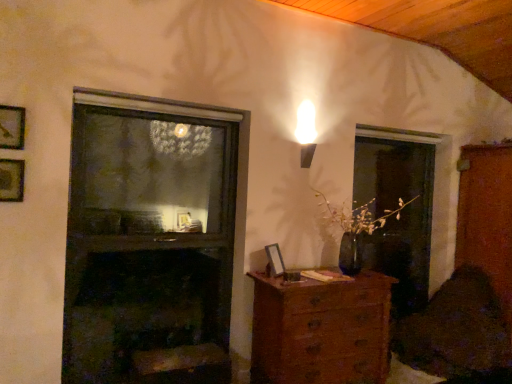
Measure the distance between wooden picture frame at lower center, which is the first picture frame in right-to-left order, and camera.

wooden picture frame at lower center, which is the first picture frame in right-to-left order, and camera are 2.97 meters apart from each other.

This screenshot has width=512, height=384. Describe the element at coordinates (486, 215) in the screenshot. I see `wooden file cabinet at right` at that location.

This screenshot has height=384, width=512. Find the location of `transparent glass screen door at right`. transparent glass screen door at right is located at coordinates (401, 213).

From the image's perspective, is wooden picture frame at upper left, acting as the second picture frame starting from the right, above or below transparent glass screen door at right?

Based on their image positions, wooden picture frame at upper left, acting as the second picture frame starting from the right, is located above transparent glass screen door at right.

In the scene shown: Is wooden picture frame at upper left, which is the third picture frame in back-to-front order, aimed at transparent glass screen door at right?

No, wooden picture frame at upper left, which is the third picture frame in back-to-front order, is not turned towards transparent glass screen door at right.

Is wooden picture frame at upper left, the second picture frame in the left-to-right sequence, inside the boundaries of transparent glass screen door at right, or outside?

The correct answer is: outside.

Between wooden picture frame at upper left, acting as the second picture frame starting from the right, and transparent glass screen door at right, which one has smaller width?

With smaller width is wooden picture frame at upper left, acting as the second picture frame starting from the right.

Is wooden picture frame at lower center, which is counted as the third picture frame, starting from the top, aimed at transparent glass screen door at right?

No, wooden picture frame at lower center, which is counted as the third picture frame, starting from the top, is not facing towards transparent glass screen door at right.

Does wooden picture frame at lower center, marked as the 1th picture frame in a bottom-to-top arrangement, have a smaller size compared to transparent glass screen door at right?

Yes.

From the image's perspective, does wooden picture frame at lower center, which is the first picture frame in right-to-left order, appear lower than transparent glass screen door at right?

Correct, wooden picture frame at lower center, which is the first picture frame in right-to-left order, appears lower than transparent glass screen door at right in the image.

Is wooden picture frame at upper left, acting as the second picture frame starting from the right, to the left of wooden file cabinet at right from the viewer's perspective?

Yes.

Is wooden picture frame at upper left, which is the 1th picture frame from top to bottom, shorter than wooden file cabinet at right?

Yes, wooden picture frame at upper left, which is the 1th picture frame from top to bottom, is shorter than wooden file cabinet at right.

From a real-world perspective, is wooden picture frame at upper left, which is the 1th picture frame from top to bottom, beneath wooden file cabinet at right?

No, from a real-world perspective, wooden picture frame at upper left, which is the 1th picture frame from top to bottom, is not under wooden file cabinet at right.

Is point (1, 186) positioned before point (2, 108)?

No.

At what (x,y) coordinates should I click in order to perform the action: click on picture frame above the wooden picture frame at upper left, the second picture frame from the front (from the image's perspective). Please return your answer as a coordinate pair (x, y). The width and height of the screenshot is (512, 384). Looking at the image, I should click on tap(12, 127).

From a real-world perspective, between wooden picture frame at upper left, the second picture frame from the front, and wooden picture frame at upper left, which is the 1th picture frame from top to bottom, who is vertically lower?

In real-world perspective, wooden picture frame at upper left, the second picture frame from the front, is lower.

In the scene shown: In the image, is wooden picture frame at upper left, marked as the 2th picture frame in a bottom-to-top arrangement, on the left side or the right side of wooden picture frame at upper left, positioned as the 3th picture frame in bottom-to-top order?

wooden picture frame at upper left, marked as the 2th picture frame in a bottom-to-top arrangement, is to the left of wooden picture frame at upper left, positioned as the 3th picture frame in bottom-to-top order.

Consider the image. Is transparent glass screen door at right bigger than velvet dark brown swivel chair at lower right?

Actually, transparent glass screen door at right might be smaller than velvet dark brown swivel chair at lower right.

Would you say velvet dark brown swivel chair at lower right is part of transparent glass screen door at right's contents?

That's incorrect, velvet dark brown swivel chair at lower right is not inside transparent glass screen door at right.

Does point (406, 162) lie behind point (483, 367)?

Yes, it is.

Measure the distance from wooden file cabinet at right to velvet dark brown swivel chair at lower right.

They are 20.22 inches apart.

Which of these two, wooden file cabinet at right or velvet dark brown swivel chair at lower right, is bigger?

wooden file cabinet at right is bigger.

The height and width of the screenshot is (384, 512). I want to click on file cabinet behind the velvet dark brown swivel chair at lower right, so click(486, 215).

In terms of height, does wooden file cabinet at right look taller or shorter compared to velvet dark brown swivel chair at lower right?

Considering their sizes, wooden file cabinet at right has more height than velvet dark brown swivel chair at lower right.

Based on the photo, from the image's perspective, who appears lower, wooden picture frame at upper left, marked as the 2th picture frame in a bottom-to-top arrangement, or velvet dark brown swivel chair at lower right?

velvet dark brown swivel chair at lower right, from the image's perspective.

Is wooden picture frame at upper left, which is the 2th picture frame in back-to-front order, in front of velvet dark brown swivel chair at lower right?

Yes, wooden picture frame at upper left, which is the 2th picture frame in back-to-front order, is closer to the viewer.

Between point (23, 187) and point (457, 311), which one is positioned behind?

The point (457, 311) is behind.

Is wooden picture frame at upper left, the second picture frame from the front, wider or thinner than velvet dark brown swivel chair at lower right?

Considering their sizes, wooden picture frame at upper left, the second picture frame from the front, looks slimmer than velvet dark brown swivel chair at lower right.

At what (x,y) coordinates should I click in order to perform the action: click on screen door on the right of wooden picture frame at upper left, positioned as the 3th picture frame in bottom-to-top order. Please return your answer as a coordinate pair (x, y). The image size is (512, 384). Looking at the image, I should click on (401, 213).

Find the location of a particular element. The width and height of the screenshot is (512, 384). picture frame that is the 1st object to the left of the transparent glass screen door at right, starting at the anchor is located at coordinates (275, 260).

Looking at the image, which one is located further to dark glass fireplace at center, transparent glass screen door at right or wooden picture frame at upper left, which is the 1th picture frame from top to bottom?

transparent glass screen door at right is further to dark glass fireplace at center.

Looking at the image, which one is located closer to dark glass fireplace at center, wooden picture frame at upper left, the third picture frame in the right-to-left sequence, or wooden file cabinet at right?

Based on the image, wooden picture frame at upper left, the third picture frame in the right-to-left sequence, appears to be nearer to dark glass fireplace at center.

Which object lies nearer to the anchor point wooden picture frame at lower center, which is the first picture frame from back to front, wooden file cabinet at right or wooden chest of drawers at lower center?

The object closer to wooden picture frame at lower center, which is the first picture frame from back to front, is wooden chest of drawers at lower center.

Estimate the real-world distances between objects in this image. Which object is further from wooden chest of drawers at lower center, velvet dark brown swivel chair at lower right or wooden picture frame at lower center, marked as the 1th picture frame in a bottom-to-top arrangement?

velvet dark brown swivel chair at lower right is positioned further to the anchor wooden chest of drawers at lower center.

From the image, which object appears to be nearer to wooden chest of drawers at lower center, wooden picture frame at upper left, which is the third picture frame in back-to-front order, or transparent glass screen door at right?

transparent glass screen door at right lies closer to wooden chest of drawers at lower center than the other object.

Consider the image. From the image, which object appears to be nearer to wooden file cabinet at right, velvet dark brown swivel chair at lower right or dark glass fireplace at center?

Based on the image, velvet dark brown swivel chair at lower right appears to be nearer to wooden file cabinet at right.

Which object lies nearer to the anchor point wooden chest of drawers at lower center, wooden picture frame at upper left, the 1th picture frame when ordered from front to back, or dark glass fireplace at center?

Based on the image, dark glass fireplace at center appears to be nearer to wooden chest of drawers at lower center.

From the image, which object appears to be nearer to dark glass fireplace at center, wooden picture frame at upper left, marked as the 2th picture frame in a bottom-to-top arrangement, or velvet dark brown swivel chair at lower right?

Based on the image, wooden picture frame at upper left, marked as the 2th picture frame in a bottom-to-top arrangement, appears to be nearer to dark glass fireplace at center.

Locate an element on the screen. chest of drawers between wooden picture frame at lower center, which is the first picture frame from back to front, and transparent glass screen door at right is located at coordinates (321, 330).

Where is `fireplace situated between wooden picture frame at upper left, the second picture frame from the front, and wooden file cabinet at right from left to right`? fireplace situated between wooden picture frame at upper left, the second picture frame from the front, and wooden file cabinet at right from left to right is located at coordinates (149, 237).

Locate an element on the screen. Image resolution: width=512 pixels, height=384 pixels. swivel chair between dark glass fireplace at center and wooden file cabinet at right in the horizontal direction is located at coordinates (458, 332).

Image resolution: width=512 pixels, height=384 pixels. I want to click on screen door between wooden picture frame at upper left, which is the 2th picture frame in back-to-front order, and velvet dark brown swivel chair at lower right, in the horizontal direction, so click(x=401, y=213).